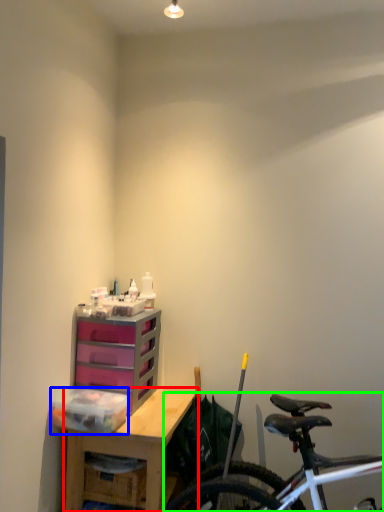
Question: Which object is the farthest from desk (highlighted by a red box)? Choose among these: storage box (highlighted by a blue box) or bicycle (highlighted by a green box).

Choices:
 (A) storage box
 (B) bicycle

Answer: (B)